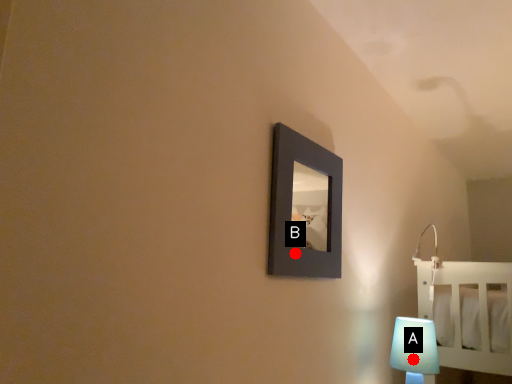
Question: Two points are circled on the image, labeled by A and B beside each circle. Which point appears farthest from the camera in this image?

Choices:
 (A) A is further
 (B) B is further

Answer: (A)